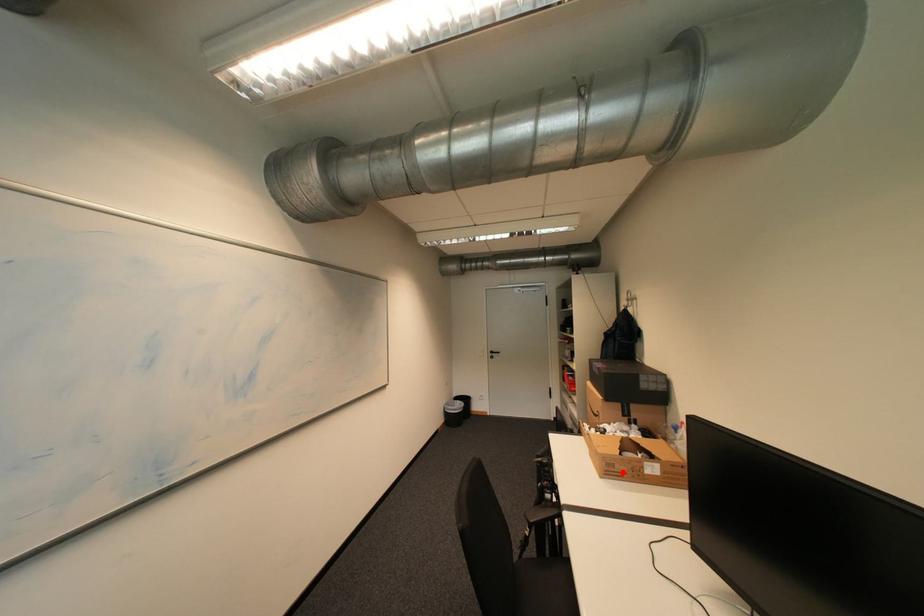
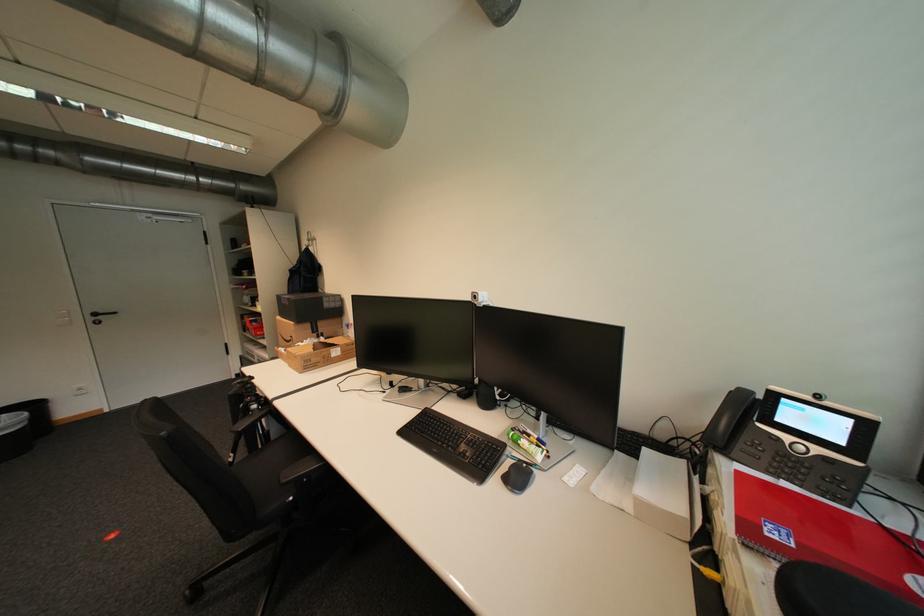
Where in the second image is the point corresponding to the highlighted location from the first image?

(319, 365)